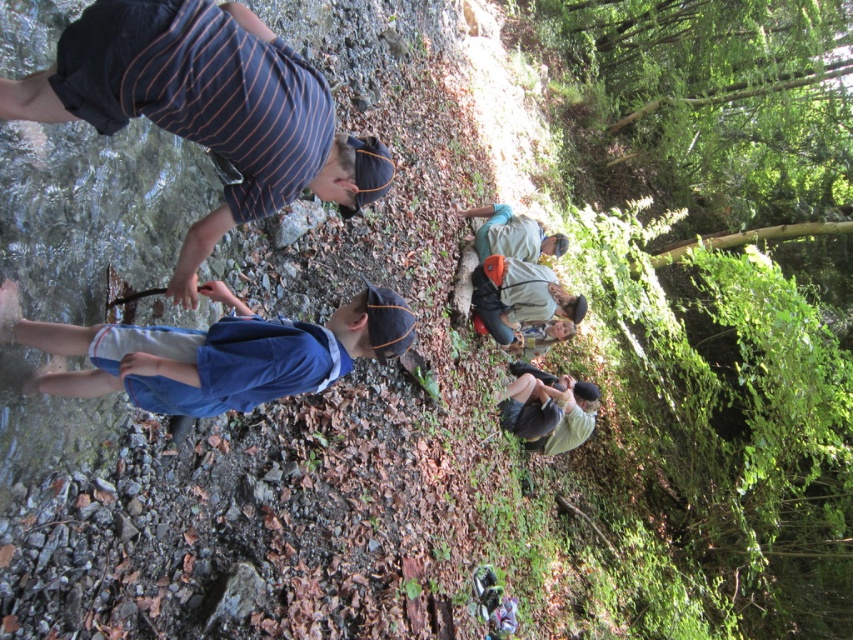
Question: Is the position of striped cotton shirt at upper left less distant than that of light green fabric at lower right?

Choices:
 (A) yes
 (B) no

Answer: (A)

Question: Among these points, which one is nearest to the camera?

Choices:
 (A) (532, 444)
 (B) (57, 100)

Answer: (B)

Question: Does striped cotton shirt at upper left have a larger size compared to light green fabric at lower right?

Choices:
 (A) no
 (B) yes

Answer: (B)

Question: Is striped cotton shirt at upper left wider than light green fabric at lower right?

Choices:
 (A) no
 (B) yes

Answer: (B)